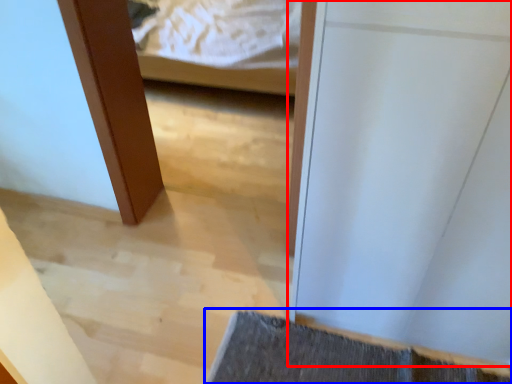
Question: Among these objects, which one is farthest to the camera, door (highlighted by a red box) or bath mat (highlighted by a blue box)?

Choices:
 (A) door
 (B) bath mat

Answer: (B)